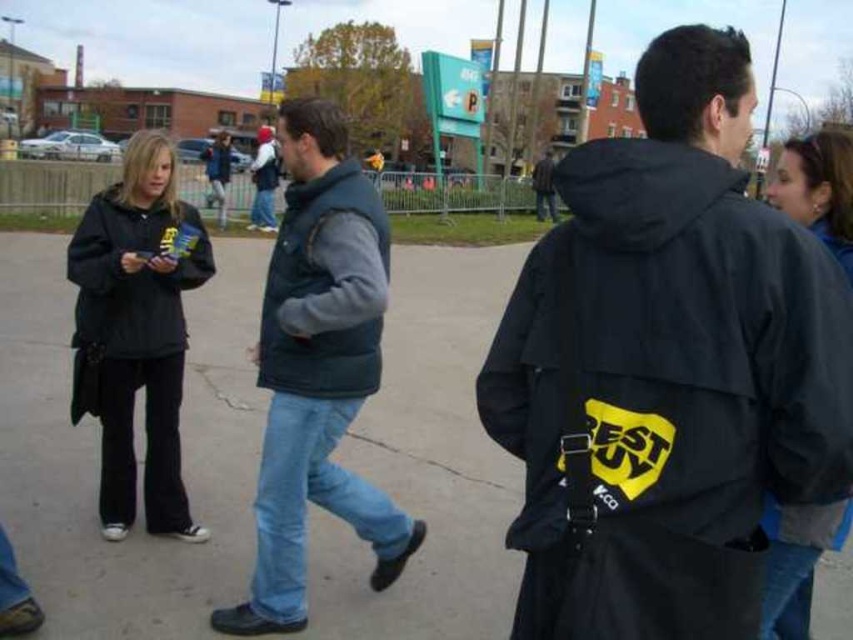
From the picture: Can you confirm if black fabric jacket at center is thinner than dark gray jacket at center?

Indeed, black fabric jacket at center has a lesser width compared to dark gray jacket at center.

Between black fabric jacket at center and dark gray jacket at center, which one is positioned higher?

dark gray jacket at center is higher up.

Who is more distant from viewer, (x=604, y=449) or (x=552, y=196)?

Point (x=552, y=196)

You are a GUI agent. You are given a task and a screenshot of the screen. Output one action in this format:
    pyautogui.click(x=<x>, y=<y>)
    Task: Click on the black fabric jacket at center
    The height and width of the screenshot is (640, 853).
    Given the screenshot: What is the action you would take?
    pyautogui.click(x=670, y=365)

Does denim jeans at center appear under blue denim jeans at center?

Indeed, denim jeans at center is positioned under blue denim jeans at center.

Which is more to the left, denim jeans at center or blue denim jeans at center?

blue denim jeans at center is more to the left.

Does point (276, 147) lie behind point (221, 131)?

No.

The height and width of the screenshot is (640, 853). In order to click on denim jeans at center in this screenshot , I will do `click(264, 180)`.

Is dark blue denim jeans at center below dark gray jacket at center?

Indeed, dark blue denim jeans at center is positioned under dark gray jacket at center.

Does dark blue denim jeans at center appear over dark gray jacket at center?

No.

Between point (376, 570) and point (538, 170), which one is positioned in front?

Point (376, 570) is more forward.

Where is `dark blue denim jeans at center`? dark blue denim jeans at center is located at coordinates (317, 369).